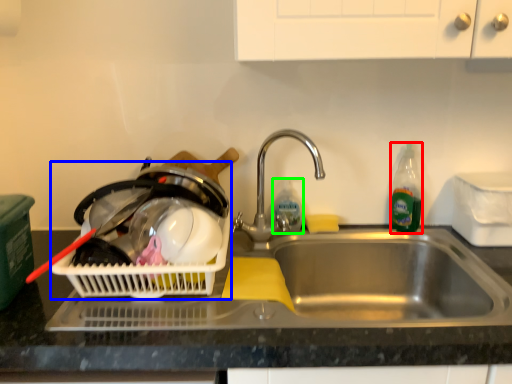
Question: Which object is positioned farthest from bottle (highlighted by a red box)? Select from basket container (highlighted by a blue box) and bottle (highlighted by a green box).

Choices:
 (A) basket container
 (B) bottle

Answer: (A)